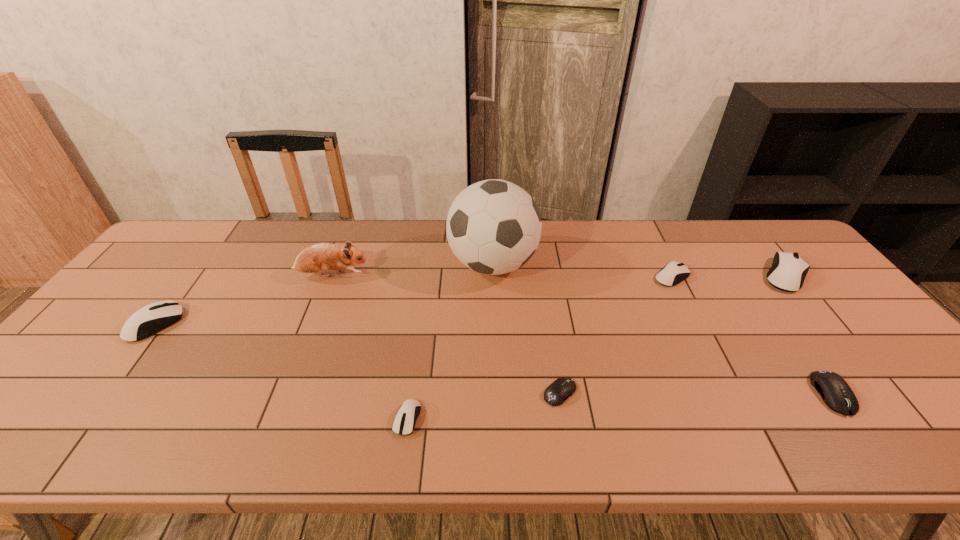
I want to click on vacant area that lies between the brown hamster and the tallest computer equipment, so click(560, 275).

The image size is (960, 540). I want to click on vacant space that is in between the second object from left to right and the soccer ball, so click(x=413, y=270).

Find the location of a particular element. vacant area between the hamster and the rightmost computer equipment is located at coordinates (560, 275).

At what (x,y) coordinates should I click in order to perform the action: click on unoccupied area between the brown hamster and the rightmost white mouse. Please return your answer as a coordinate pair (x, y). Looking at the image, I should click on (560, 275).

I want to click on free spot between the hamster and the fourth tallest object, so click(244, 300).

Where is `vacant point located between the bigger black computer equipment and the biggest white mouse`? The height and width of the screenshot is (540, 960). vacant point located between the bigger black computer equipment and the biggest white mouse is located at coordinates (809, 335).

The height and width of the screenshot is (540, 960). In order to click on object that is the fourth closest to the tallest object in this screenshot , I will do `click(404, 422)`.

Locate an element on the screen. The height and width of the screenshot is (540, 960). object that is the sixth closest to the black soccer ball is located at coordinates (788, 271).

Identify which computer equipment is the third nearest to the third white mouse from left to right. Please provide its 2D coordinates. Your answer should be formatted as a tuple, i.e. [(x, y)], where the tuple contains the x and y coordinates of a point satisfying the conditions above.

[(561, 389)]

Identify the location of computer equipment that is the third closest to the fifth computer equipment from left to right. (561, 389).